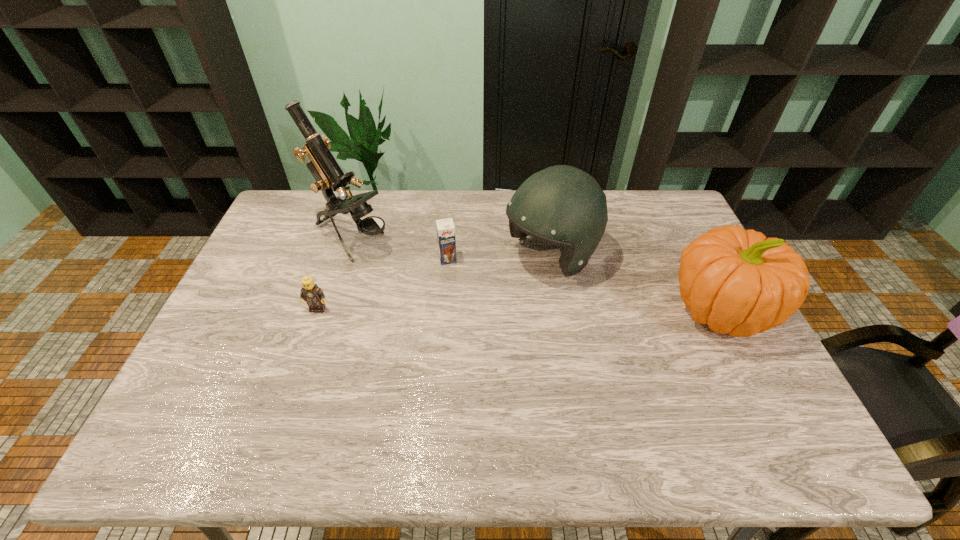
Locate an element on the screen. object located at the far left corner is located at coordinates (329, 177).

Identify the location of vacant space at the far edge of the desktop. This screenshot has width=960, height=540. (613, 205).

This screenshot has width=960, height=540. I want to click on vacant space at the near edge of the desktop, so click(x=457, y=393).

Where is `vacant space at the far left corner`? The height and width of the screenshot is (540, 960). vacant space at the far left corner is located at coordinates (311, 228).

Find the location of a particular element. The image size is (960, 540). vacant space at the near left corner is located at coordinates (185, 394).

The height and width of the screenshot is (540, 960). In order to click on free space at the near right corner of the desktop in this screenshot , I will do `click(724, 392)`.

The image size is (960, 540). Identify the location of free point between the fourth tallest object and the tallest object. (399, 249).

At what (x,y) coordinates should I click in order to perform the action: click on free space between the second shortest object and the football helmet. Please return your answer as a coordinate pair (x, y). This screenshot has width=960, height=540. Looking at the image, I should click on (499, 258).

Find the location of a particular element. Image resolution: width=960 pixels, height=540 pixels. free area in between the second shortest object and the rightmost object is located at coordinates (586, 284).

I want to click on vacant area that lies between the tallest object and the rightmost object, so click(538, 274).